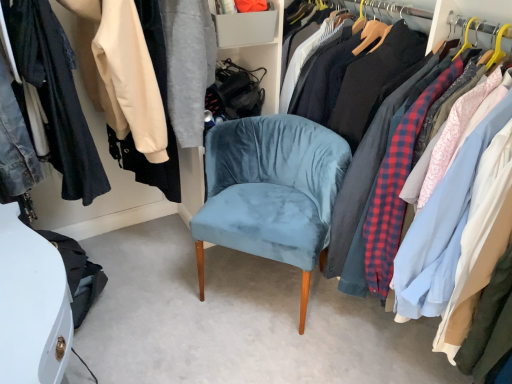
Question: From their relative heights in the image, would you say velvet blue chair at center is taller or shorter than velvet blue chair at center?

Choices:
 (A) short
 (B) tall

Answer: (B)

Question: Is velvet blue chair at center in front of or behind velvet blue chair at center in the image?

Choices:
 (A) front
 (B) behind

Answer: (A)

Question: Would you say velvet blue chair at center is to the left or to the right of velvet blue chair at center in the picture?

Choices:
 (A) left
 (B) right

Answer: (B)

Question: Relative to velvet blue chair at center, is velvet blue chair at center in front or behind?

Choices:
 (A) front
 (B) behind

Answer: (B)

Question: Which is correct: velvet blue chair at center is inside velvet blue chair at center, or outside of it?

Choices:
 (A) outside
 (B) inside

Answer: (A)

Question: From the image's perspective, relative to velvet blue chair at center, is velvet blue chair at center above or below?

Choices:
 (A) above
 (B) below

Answer: (A)

Question: From a real-world perspective, is velvet blue chair at center above or below velvet blue chair at center?

Choices:
 (A) above
 (B) below

Answer: (B)